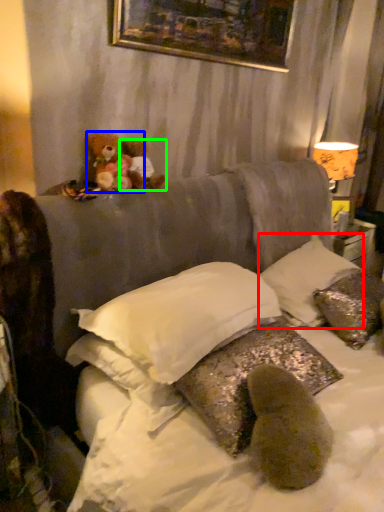
Question: Which object is positioned closest to pillow (highlighted by a red box)? Select from teddy bear (highlighted by a blue box) and teddy bear (highlighted by a green box).

Choices:
 (A) teddy bear
 (B) teddy bear

Answer: (B)